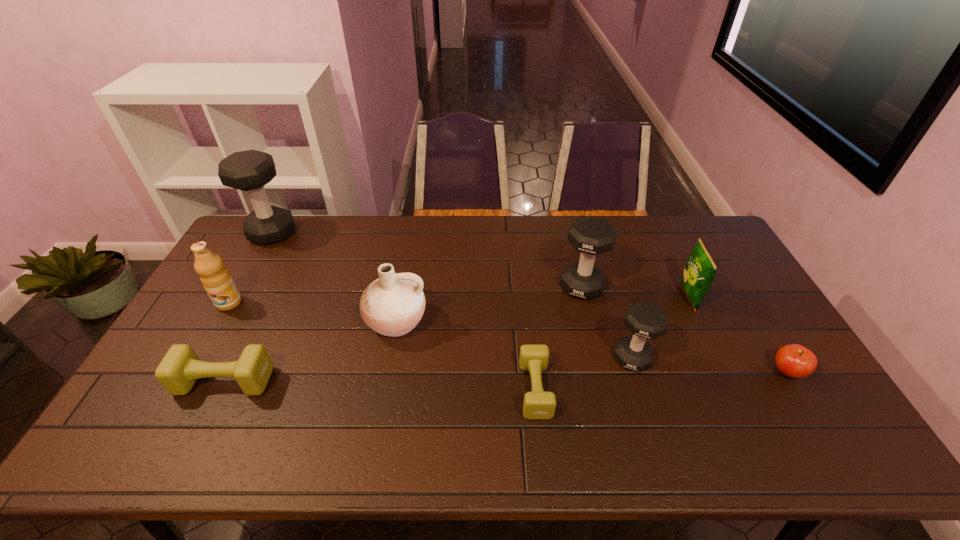
Locate an element on the screen. The width and height of the screenshot is (960, 540). the farthest object is located at coordinates (250, 170).

You are a GUI agent. You are given a task and a screenshot of the screen. Output one action in this format:
    pyautogui.click(x=<x>, y=<y>)
    Task: Click on the tallest dumbbell
    
    Given the screenshot: What is the action you would take?
    pyautogui.click(x=250, y=170)

Identify the location of the second smallest gray dumbbell. The image size is (960, 540). (590, 235).

This screenshot has height=540, width=960. I want to click on the second nearest gray dumbbell, so click(590, 235).

Locate an element on the screen. olive oil is located at coordinates (216, 279).

The image size is (960, 540). Identify the location of the fourth object from left to right. (392, 305).

Find the location of `pottery`. pottery is located at coordinates (392, 305).

Where is `the second object from right to left`? This screenshot has height=540, width=960. the second object from right to left is located at coordinates (700, 271).

In order to click on crisp (potato chip) in this screenshot , I will do `click(700, 271)`.

At what (x,y) coordinates should I click in order to perform the action: click on the nearest gray dumbbell. Please return your answer as a coordinate pair (x, y). The height and width of the screenshot is (540, 960). Looking at the image, I should click on (645, 320).